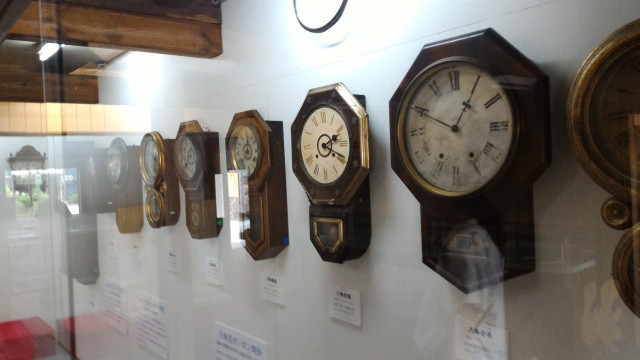
Find the location of a particular element. The width and height of the screenshot is (640, 360). reflection of light on wall is located at coordinates (143, 72), (371, 18).